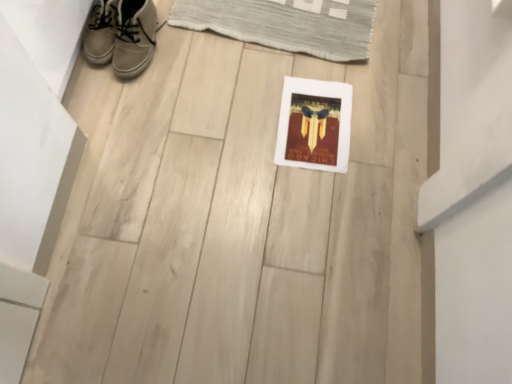
This screenshot has height=384, width=512. Find the location of `vacant area on the back side of white matte picture frame at center`. vacant area on the back side of white matte picture frame at center is located at coordinates (320, 54).